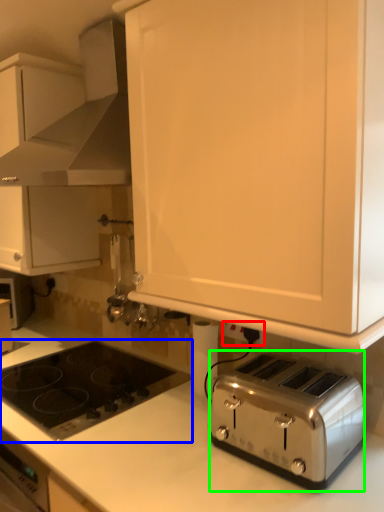
Question: Which object is positioned closest to electric outlet (highlighted by a red box)? Select from gas stove (highlighted by a blue box) and toaster (highlighted by a green box).

Choices:
 (A) gas stove
 (B) toaster

Answer: (B)